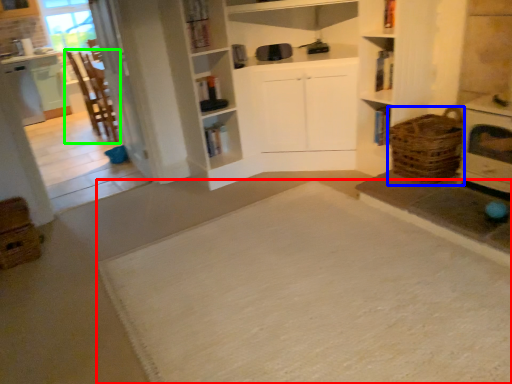
Question: Based on their relative distances, which object is nearer to doormat (highlighted by a red box)? Choose from basket (highlighted by a blue box) and chair (highlighted by a green box).

Choices:
 (A) basket
 (B) chair

Answer: (A)